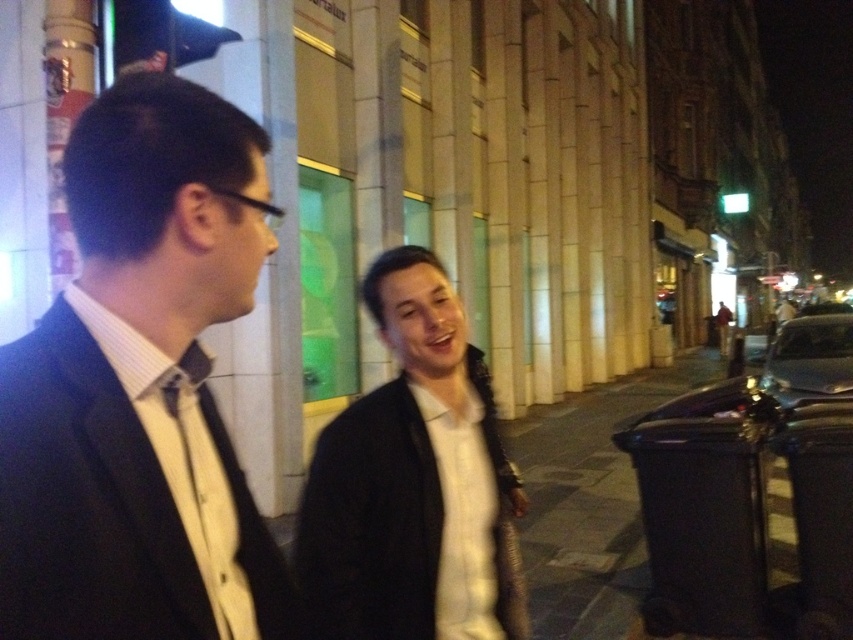
You are a photographer trying to capture a group photo of the black matte suit at left and the white matte jacket at center. Since you want to ensure both subjects are visible, which side should you position the camera to capture both individuals without cropping either of them?

The black matte suit at left is positioned on the left side of white matte jacket at center. To capture both subjects without cropping, position the camera to the right side of the white matte jacket at center so that both the black matte suit at left and the white matte jacket at center are fully visible in the frame.

You are a photographer standing at the center of the scene. You want to take a photo that includes both the white matte jacket at center and the matte black bow tie at center. What is the minimum distance you need to move backward to ensure both objects are fully visible in your camera frame?

The white matte jacket at center and the matte black bow tie at center are 29.75 inches apart. To ensure both are fully visible, you need to move backward until the camera frame can encompass at least 29.75 inches between them.

You are a photographer trying to capture a photo of the black matte suit at left and the white matte jacket at center. Based on their positions, which one is positioned higher in the frame?

The black matte suit at left is located above the white matte jacket at center, so it is positioned higher in the frame.